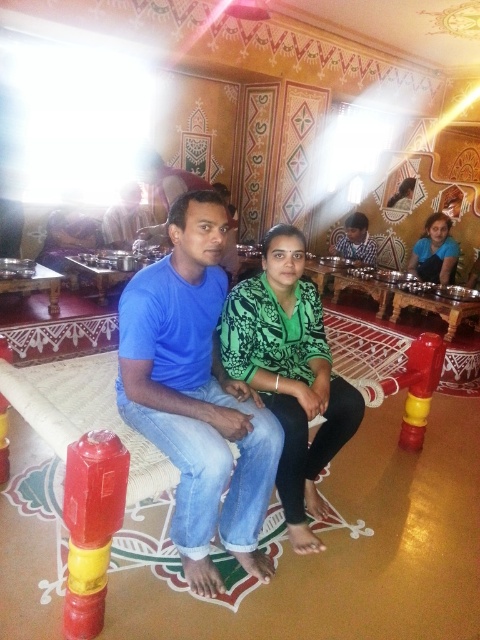
You are standing in the room and want to place a small decorative item exactly at the point marked as point (86, 451). If your arm reaches out 4 feet, can you comfortably place the item there without moving your feet?

The distance of point (86, 451) from the camera is 4.86 feet. Since your arm reaches 4 feet, you cannot comfortably place the item there without moving your feet as the distance is greater than your reach.